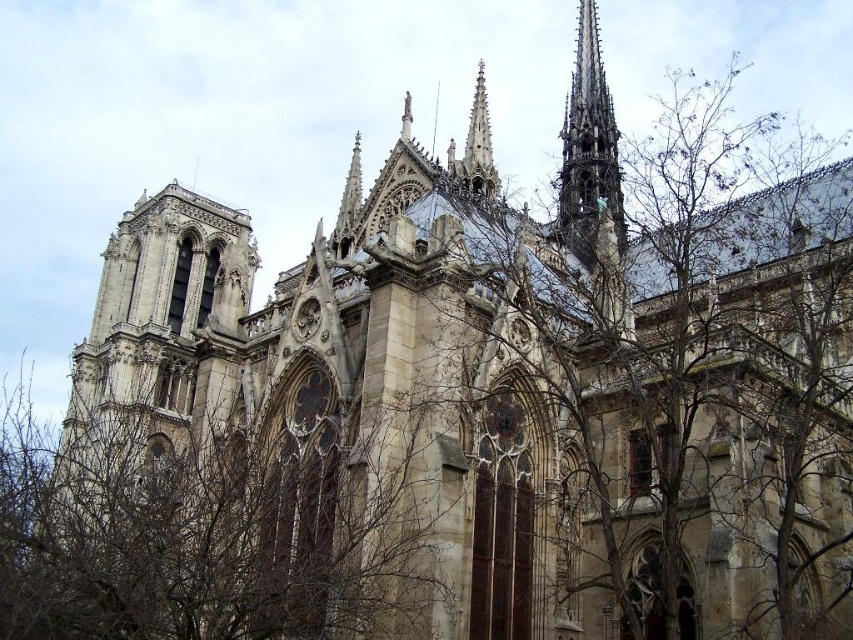
Is point (590, 76) positioned before point (486, 157)?

No, it is not.

Which of these two, stone spire at upper right or smooth stone spire at upper center, stands taller?

Standing taller between the two is stone spire at upper right.

You are a GUI agent. You are given a task and a screenshot of the screen. Output one action in this format:
    pyautogui.click(x=<x>, y=<y>)
    Task: Click on the stone spire at upper right
    
    Given the screenshot: What is the action you would take?
    pyautogui.click(x=589, y=148)

Does brown leafless branches at lower left appear under stone spire at upper right?

Correct, brown leafless branches at lower left is located below stone spire at upper right.

At what (x,y) coordinates should I click in order to perform the action: click on brown leafless branches at lower left. Please return your answer as a coordinate pair (x, y). This screenshot has width=853, height=640. Looking at the image, I should click on (206, 532).

Image resolution: width=853 pixels, height=640 pixels. Find the location of `brown leafless branches at lower left`. brown leafless branches at lower left is located at coordinates 206,532.

Looking at this image, who is more forward, [36,573] or [479,76]?

Point [36,573] is more forward.

Does brown leafless branches at lower left have a greater width compared to smooth stone spire at upper center?

Indeed, brown leafless branches at lower left has a greater width compared to smooth stone spire at upper center.

Is point (90, 449) less distant than point (491, 170)?

That is False.

Locate an element on the screen. This screenshot has height=640, width=853. brown leafless branches at lower left is located at coordinates (206, 532).